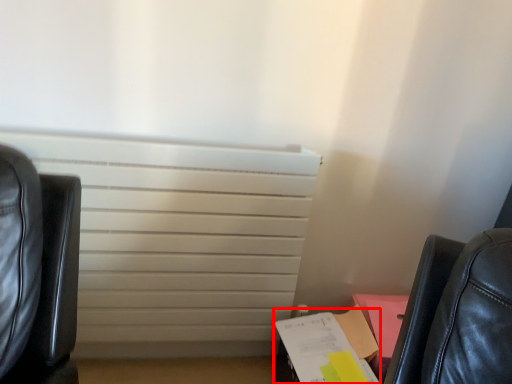
Question: From the image's perspective, what is the correct spatial positioning of paperback book (annotated by the red box) in reference to radiator?

Choices:
 (A) above
 (B) below

Answer: (B)